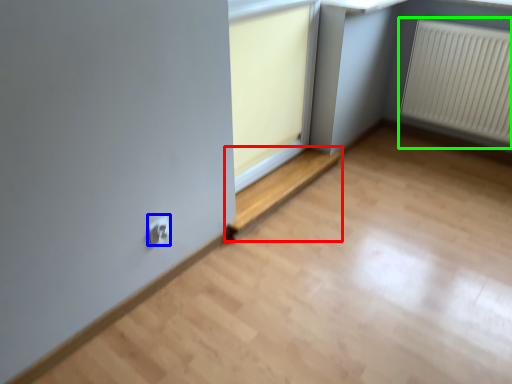
Question: Estimate the real-world distances between objects in this image. Which object is closer to window (highlighted by a red box), electric outlet (highlighted by a blue box) or radiator (highlighted by a green box)?

Choices:
 (A) electric outlet
 (B) radiator

Answer: (A)